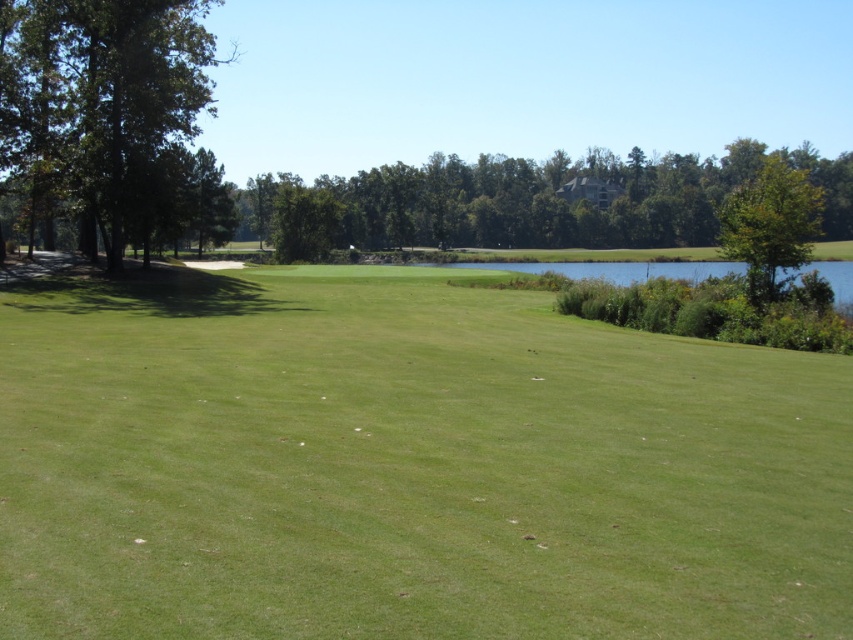
Is green grass at center positioned before green leafy tree at left?

Yes, it is in front of green leafy tree at left.

Is green grass at center to the left of green leafy tree at left from the viewer's perspective?

In fact, green grass at center is to the right of green leafy tree at left.

Is point (657, 524) closer to viewer compared to point (54, 209)?

Yes, point (657, 524) is in front of point (54, 209).

Locate an element on the screen. The width and height of the screenshot is (853, 640). green grass at center is located at coordinates (x=405, y=465).

What do you see at coordinates (405, 465) in the screenshot? I see `green grass at center` at bounding box center [405, 465].

The height and width of the screenshot is (640, 853). Describe the element at coordinates (405, 465) in the screenshot. I see `green grass at center` at that location.

Locate an element on the screen. green grass at center is located at coordinates (405, 465).

Who is more forward, (648, 216) or (782, 240)?

Point (782, 240) is in front.

Does green leafy tree at center have a lesser height compared to green leafy tree at upper right?

No.

I want to click on green leafy tree at center, so click(537, 202).